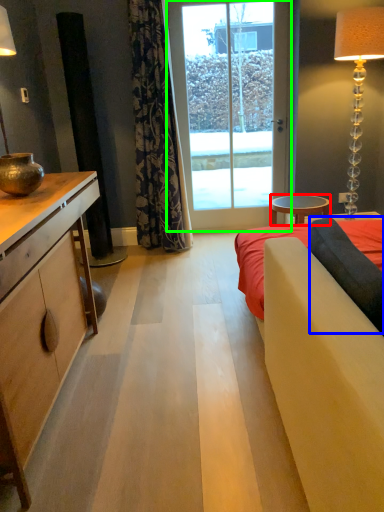
Question: Which object is the farthest from table (highlighted by a red box)? Choose among these: pillow (highlighted by a blue box) or glass door (highlighted by a green box).

Choices:
 (A) pillow
 (B) glass door

Answer: (A)